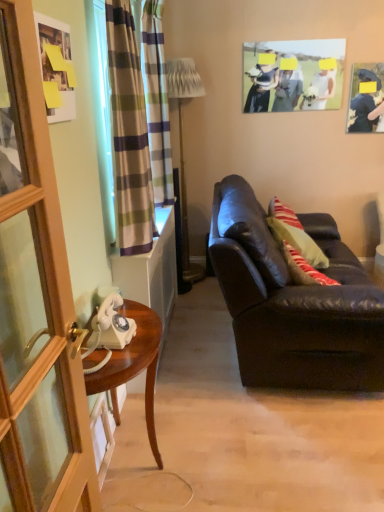
Question: Would you say metallic gold floor lamp at center is to the left or to the right of matte paper photo frame at upper center, which ranks as the 2th picture frame in right-to-left order, in the picture?

Choices:
 (A) left
 (B) right

Answer: (A)

Question: From a real-world perspective, is metallic gold floor lamp at center physically located above or below matte paper photo frame at upper center, the first picture frame from the top?

Choices:
 (A) above
 (B) below

Answer: (B)

Question: Which object is the closest to the wooden screen door at left?

Choices:
 (A) plaid fabric curtain at left, placed as the first curtain when sorted from front to back
 (B) matte black couch at right
 (C) matte paper photo frame at upper center, the 2th picture frame positioned from the back
 (D) white glossy telephone at left
 (E) metallic gold floor lamp at center

Answer: (A)

Question: Which of these objects is positioned closest to the matte white picture frame at upper left, which is counted as the first picture frame, starting from the front?

Choices:
 (A) matte black picture frame at upper right, placed as the third picture frame when sorted from left to right
 (B) white glossy telephone at left
 (C) plaid fabric curtain at left, acting as the 2th curtain starting from the back
 (D) wooden desk at left
 (E) metallic gold floor lamp at center

Answer: (C)